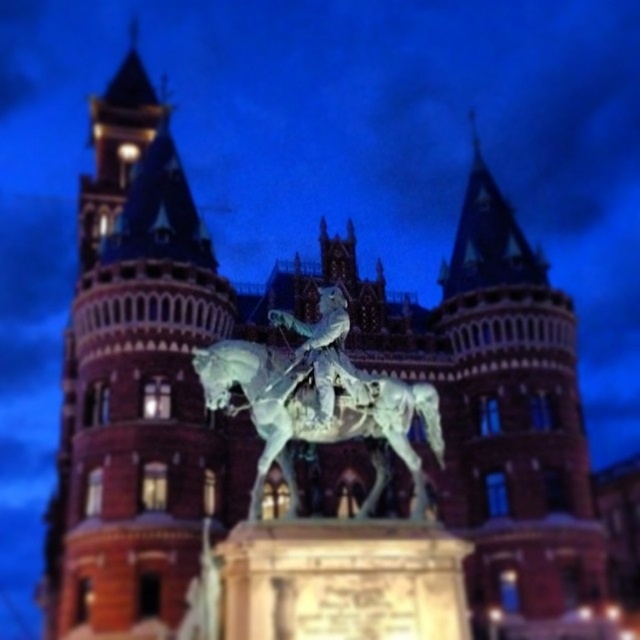
You are an art student analyzing the statue in the image. You notice two parts of the statue labeled as the polished bronze horse at center and the polished bronze statue at center. Which part is positioned more to the left?

The polished bronze horse at center is positioned more to the left than the polished bronze statue at center.